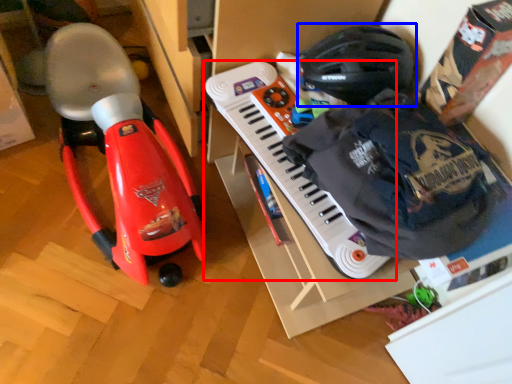
Question: Which object is further to the camera taking this photo, musical keyboard (highlighted by a red box) or helmet (highlighted by a blue box)?

Choices:
 (A) musical keyboard
 (B) helmet

Answer: (B)